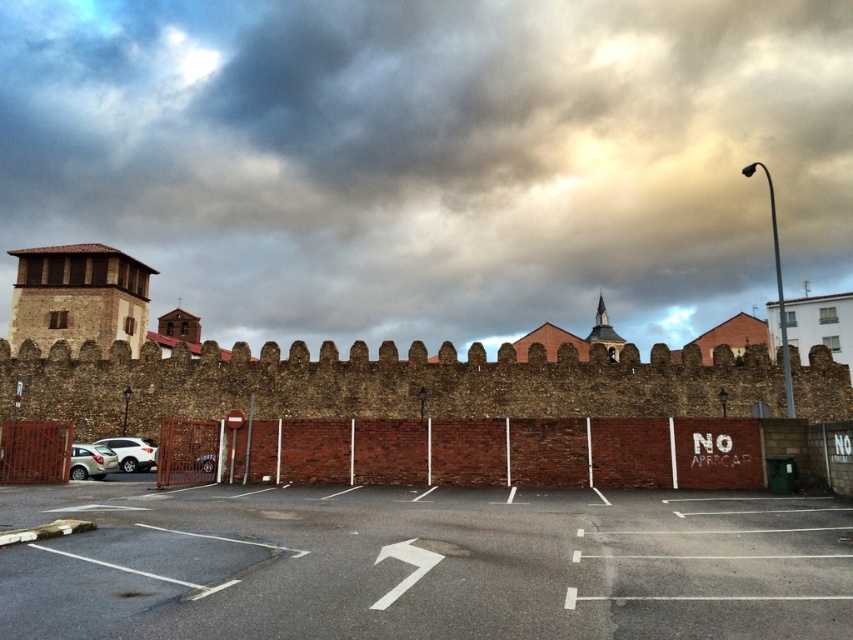
Can you confirm if cloudy sky at upper center is smaller than satin silver car at lower left?

Actually, cloudy sky at upper center might be larger than satin silver car at lower left.

I want to click on cloudy sky at upper center, so click(433, 157).

The height and width of the screenshot is (640, 853). Find the location of `cloudy sky at upper center`. cloudy sky at upper center is located at coordinates (433, 157).

Does brick wall at center appear under brown stone tower at left?

Correct, brick wall at center is located below brown stone tower at left.

Does point (471, 449) lie in front of point (7, 332)?

Yes.

The image size is (853, 640). Find the location of `brick wall at center`. brick wall at center is located at coordinates 548,451.

Is brick wall at center smaller than satin silver car at lower left?

No.

Does brick wall at center have a greater height compared to satin silver car at lower left?

Yes.

What do you see at coordinates (548, 451) in the screenshot?
I see `brick wall at center` at bounding box center [548, 451].

Where is `brick wall at center`? brick wall at center is located at coordinates (548, 451).